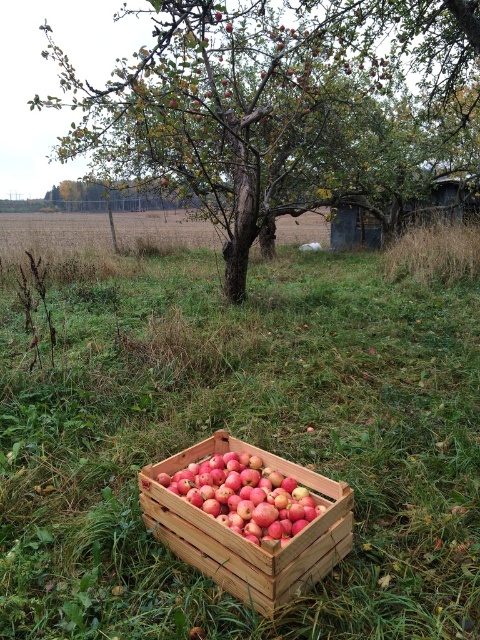
Question: Is wooden crate at center thinner than red matte apples at center?

Choices:
 (A) yes
 (B) no

Answer: (B)

Question: Estimate the real-world distances between objects in this image. Which object is farther from the wooden crate at center?

Choices:
 (A) green grass at center
 (B) red matte apples at center
 (C) green leafy tree at center

Answer: (C)

Question: Is green grass at center bigger than wooden crate at center?

Choices:
 (A) yes
 (B) no

Answer: (B)

Question: Among these points, which one is farthest from the camera?

Choices:
 (A) (223, 346)
 (B) (250, 516)
 (C) (203, 177)
 (D) (196, 515)

Answer: (C)

Question: Can you confirm if green grass at center is thinner than red matte apples at center?

Choices:
 (A) no
 (B) yes

Answer: (B)

Question: Considering the real-world distances, which object is closest to the red matte apples at center?

Choices:
 (A) green grass at center
 (B) green leafy tree at center

Answer: (A)